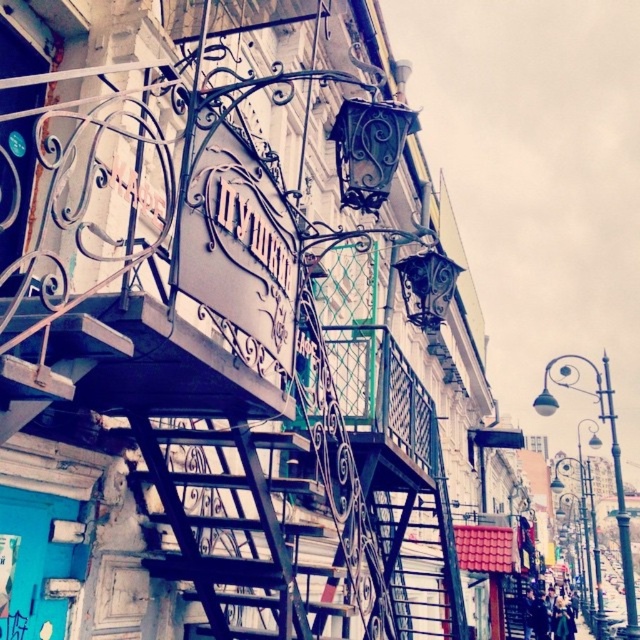
Question: Which point is closer to the camera?

Choices:
 (A) (182, 490)
 (B) (195, 572)

Answer: (B)

Question: Can you confirm if black wrought iron fire escape at center is thinner than rusty metal ladder at center?

Choices:
 (A) yes
 (B) no

Answer: (B)

Question: Which object is closer to the camera taking this photo?

Choices:
 (A) rusty metal ladder at center
 (B) black wrought iron fire escape at center

Answer: (B)

Question: Which point is closer to the camera?

Choices:
 (A) coord(460,324)
 (B) coord(307,636)

Answer: (B)

Question: Can you confirm if black wrought iron fire escape at center is positioned below rusty metal ladder at center?

Choices:
 (A) yes
 (B) no

Answer: (B)

Question: Does black wrought iron fire escape at center appear under rusty metal ladder at center?

Choices:
 (A) yes
 (B) no

Answer: (B)